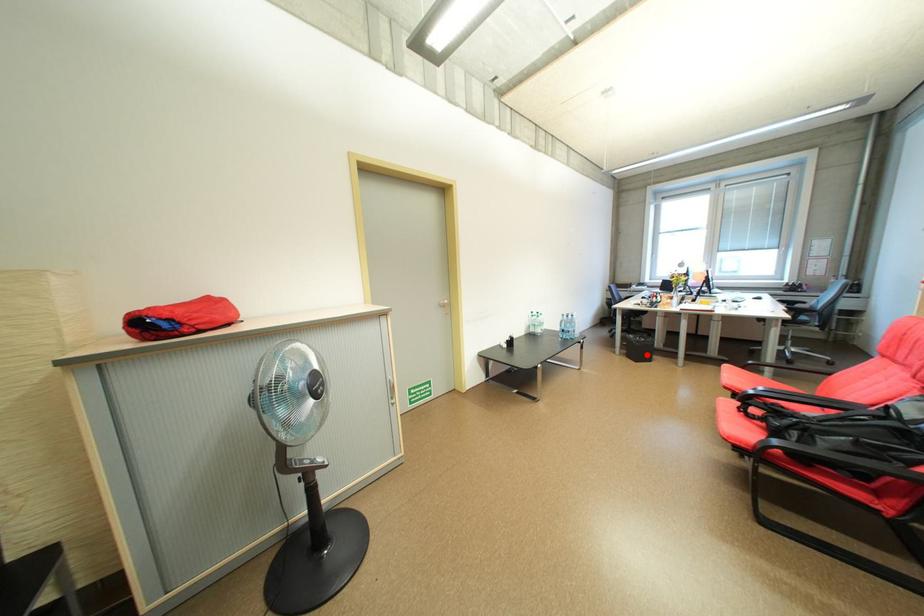
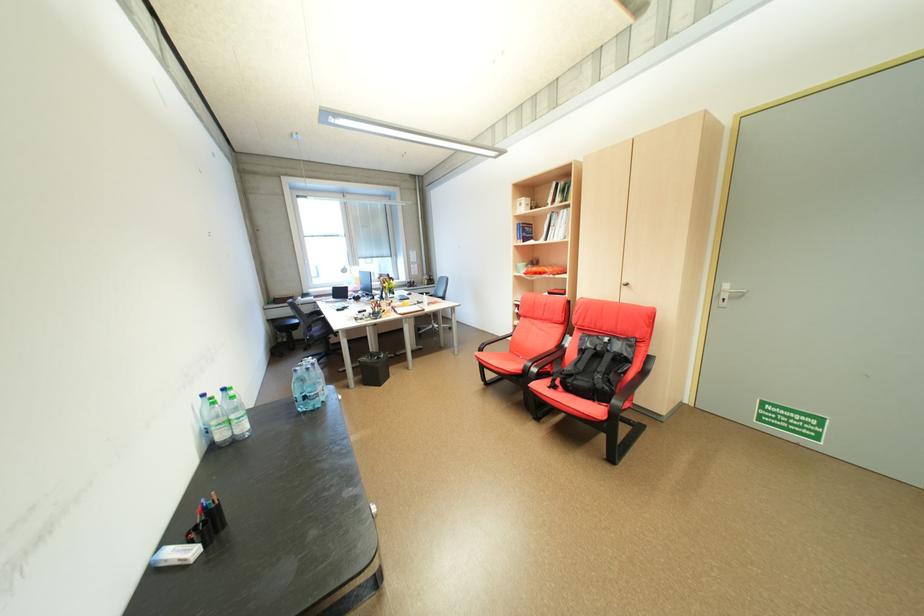
Question: I am providing you with two images of the same scene from different viewpoints. Given a red point in image1, look at the same physical point in image2. Is it:

Choices:
 (A) Closer to the viewpoint
 (B) Farther from the viewpoint

Answer: (B)